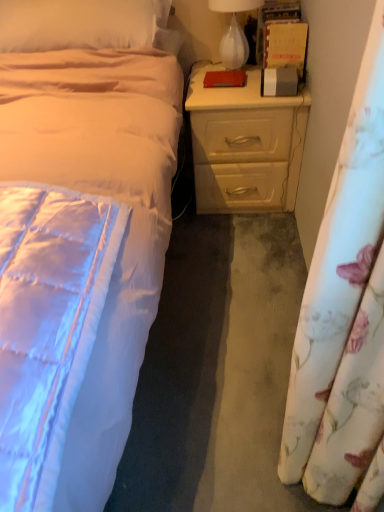
Question: Can we say beige satin pillow at upper left lies outside floral fabric curtain at right?

Choices:
 (A) no
 (B) yes

Answer: (B)

Question: From the image's perspective, would you say beige satin pillow at upper left is positioned over floral fabric curtain at right?

Choices:
 (A) no
 (B) yes

Answer: (B)

Question: Does beige satin pillow at upper left come behind floral fabric curtain at right?

Choices:
 (A) yes
 (B) no

Answer: (A)

Question: From the image's perspective, is beige satin pillow at upper left beneath floral fabric curtain at right?

Choices:
 (A) yes
 (B) no

Answer: (B)

Question: Is beige satin pillow at upper left oriented towards floral fabric curtain at right?

Choices:
 (A) no
 (B) yes

Answer: (B)

Question: Does beige satin pillow at upper left have a larger size compared to floral fabric curtain at right?

Choices:
 (A) yes
 (B) no

Answer: (A)

Question: From a real-world perspective, is white glass lamp at upper right located beneath beige satin pillow at upper left?

Choices:
 (A) yes
 (B) no

Answer: (A)

Question: From the image's perspective, is white glass lamp at upper right located beneath beige satin pillow at upper left?

Choices:
 (A) yes
 (B) no

Answer: (B)

Question: Is white glass lamp at upper right at the right side of beige satin pillow at upper left?

Choices:
 (A) no
 (B) yes

Answer: (B)

Question: Does white glass lamp at upper right have a lesser width compared to beige satin pillow at upper left?

Choices:
 (A) yes
 (B) no

Answer: (A)

Question: Are white glass lamp at upper right and beige satin pillow at upper left located far from each other?

Choices:
 (A) no
 (B) yes

Answer: (A)

Question: Does white glass lamp at upper right appear on the left side of beige satin pillow at upper left?

Choices:
 (A) yes
 (B) no

Answer: (B)

Question: Can you confirm if floral fabric curtain at right is taller than beige wood nightstand at right?

Choices:
 (A) no
 (B) yes

Answer: (B)